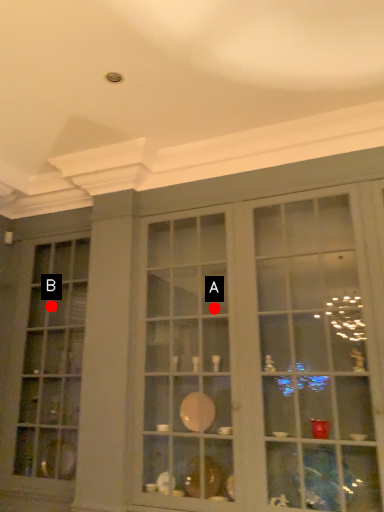
Question: Two points are circled on the image, labeled by A and B beside each circle. Which point is farther from the camera taking this photo?

Choices:
 (A) A is further
 (B) B is further

Answer: (B)